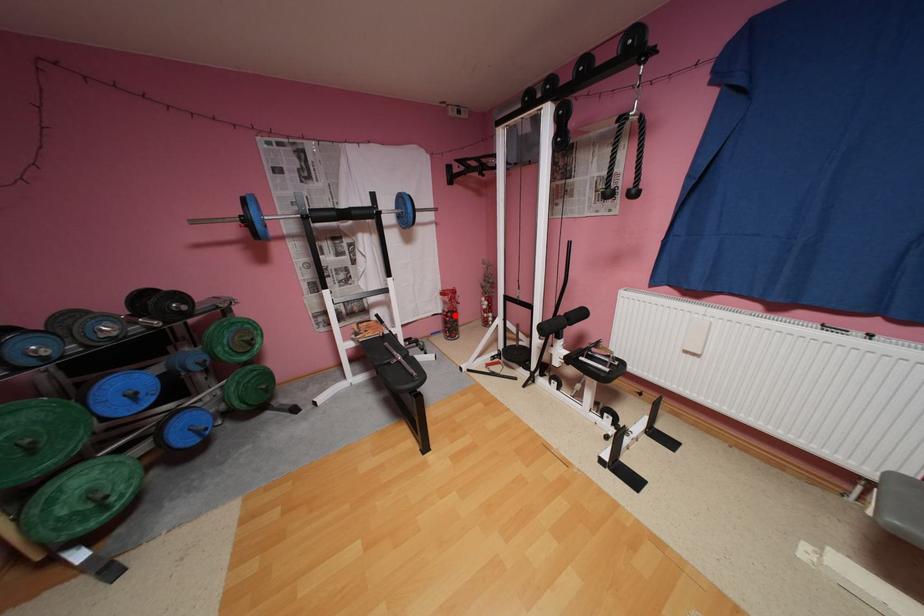
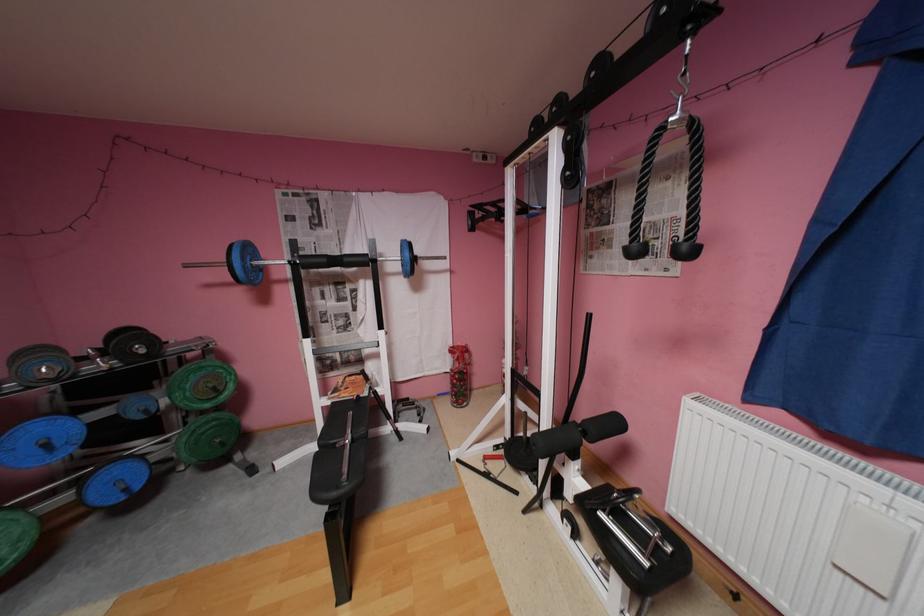
The point at the highlighted location is marked in the first image. Where is the corresponding point in the second image?

(462, 377)